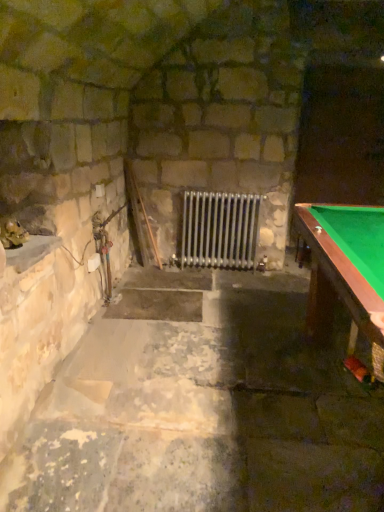
The width and height of the screenshot is (384, 512). Describe the element at coordinates (219, 229) in the screenshot. I see `silver metallic radiator at center` at that location.

In order to face silver metallic radiator at center, should I rotate leftwards or rightwards?

Rotate your view right by about 3.587°.

Identify the location of silver metallic radiator at center. (219, 229).

Locate an element on the screen. silver metallic radiator at center is located at coordinates (219, 229).